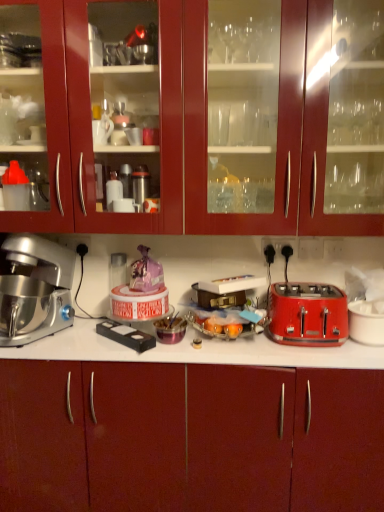
Where is `vacant space that is to the left of black plastic remote control at center`? Image resolution: width=384 pixels, height=512 pixels. vacant space that is to the left of black plastic remote control at center is located at coordinates (82, 343).